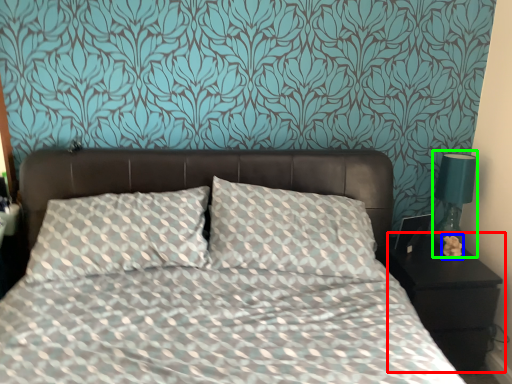
Question: Which object is the farthest from nightstand (highlighted by a red box)? Choose among these: flower (highlighted by a blue box) or bedside lamp (highlighted by a green box).

Choices:
 (A) flower
 (B) bedside lamp

Answer: (B)